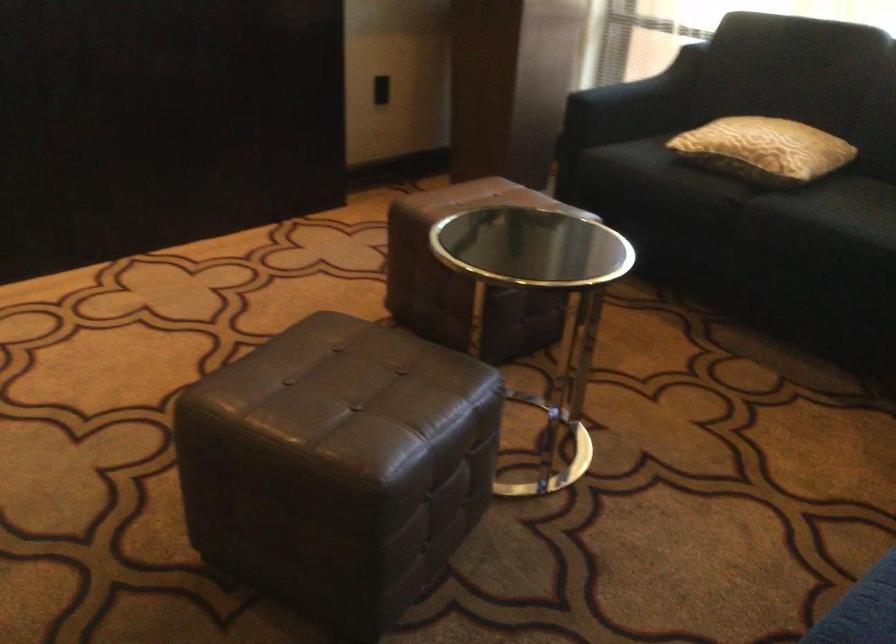
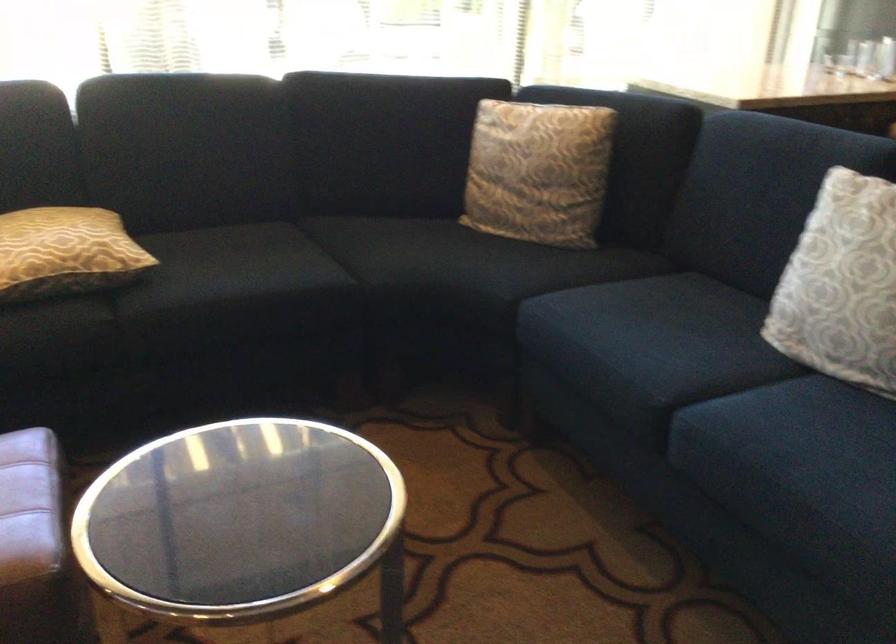
Locate, in the second image, the point that corresponds to (747,142) in the first image.

(65, 252)